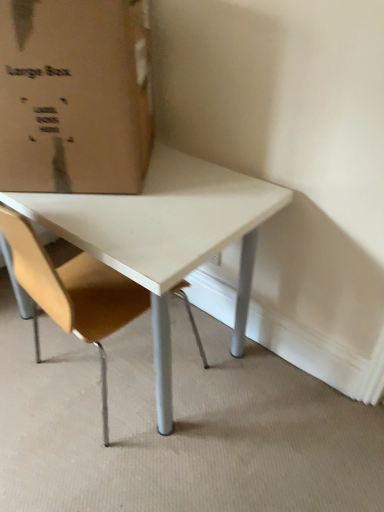
Image resolution: width=384 pixels, height=512 pixels. I want to click on free area below light brown leather chair at center (from a real-world perspective), so click(100, 379).